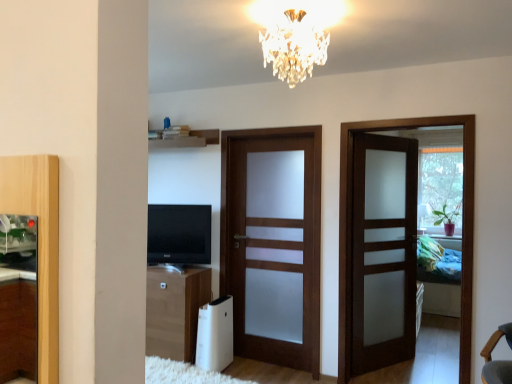
Question: From a real-world perspective, is brown matte door at center, placed as the second door when sorted from left to right, physically located above or below black glossy tv at center?

Choices:
 (A) below
 (B) above

Answer: (A)

Question: From the image's perspective, is brown matte door at center, placed as the second door when sorted from left to right, positioned above or below black glossy tv at center?

Choices:
 (A) below
 (B) above

Answer: (A)

Question: Based on their relative distances, which object is nearer to the brown matte door at center, placed as the second door when sorted from left to right?

Choices:
 (A) wooden cabinet at lower left
 (B) satin wood door at right, marked as the 3th door in a left-to-right arrangement
 (C) satin wood door at center, which appears as the first door when viewed from the left
 (D) wooden shelf at upper center
 (E) black glossy tv at center

Answer: (B)

Question: Estimate the real-world distances between objects in this image. Which object is closer to the satin wood door at right, which is the 1th door from right to left?

Choices:
 (A) wooden shelf at upper center
 (B) wooden cabinet at lower left
 (C) black glossy tv at center
 (D) white plastic air purifier at lower center
 (E) crystal glass chandelier at upper center

Answer: (D)